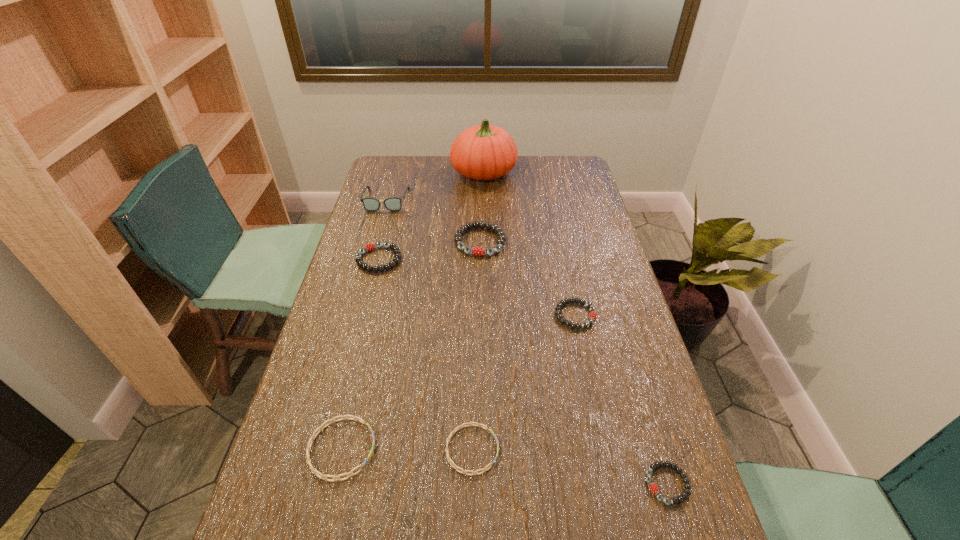
Identify the location of orange pumpkin. Image resolution: width=960 pixels, height=540 pixels. (483, 152).

You are a GUI agent. You are given a task and a screenshot of the screen. Output one action in this format:
    pyautogui.click(x=<x>, y=<y>)
    Task: Click on the tallest object
    The height and width of the screenshot is (540, 960).
    Given the screenshot: What is the action you would take?
    pyautogui.click(x=483, y=152)

Locate an element on the screen. Image resolution: width=960 pixels, height=540 pixels. the second tallest object is located at coordinates (370, 204).

What are the coordinates of `spectacles` in the screenshot? It's located at (370, 204).

You are a GUI agent. You are given a task and a screenshot of the screen. Output one action in this format:
    pyautogui.click(x=<x>, y=<y>)
    Task: Click on the biggest black bracelet
    The height and width of the screenshot is (540, 960).
    Given the screenshot: What is the action you would take?
    pyautogui.click(x=477, y=251)

In order to click on the sixth shortest object in this screenshot , I will do [x=477, y=251].

At what (x,y) coordinates should I click in order to perform the action: click on the third smallest black bracelet. Please return your answer as a coordinate pair (x, y). The width and height of the screenshot is (960, 540). Looking at the image, I should click on (368, 247).

The height and width of the screenshot is (540, 960). In order to click on the fifth shortest object in this screenshot , I will do `click(368, 247)`.

Image resolution: width=960 pixels, height=540 pixels. In order to click on the bigger blue bracelet in this screenshot , I will do `click(356, 418)`.

The width and height of the screenshot is (960, 540). What are the coordinates of `the fifth bracelet from left to right` in the screenshot? It's located at (593, 315).